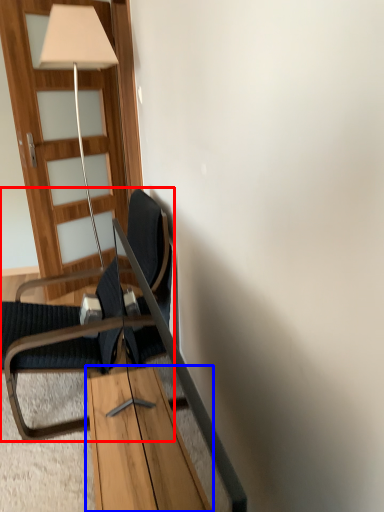
Question: Which object is closer to the camera taking this photo, chair (highlighted by a red box) or table (highlighted by a blue box)?

Choices:
 (A) chair
 (B) table

Answer: (B)